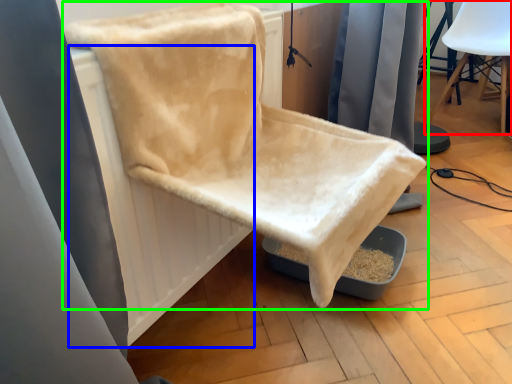
Question: Which is farther away from chair (highlighted by a red box)? radiator (highlighted by a blue box) or chair (highlighted by a green box)?

Choices:
 (A) radiator
 (B) chair

Answer: (A)